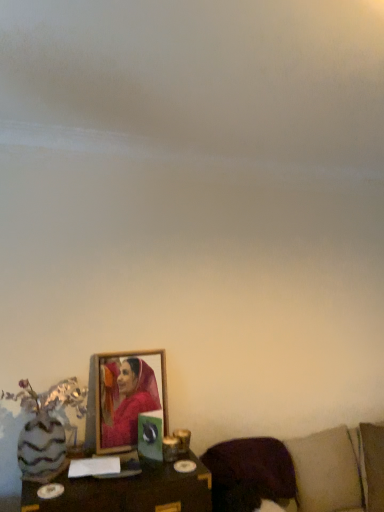
Question: Considering the positions of purple fabric pillow at lower right and wooden table at lower center in the image, is purple fabric pillow at lower right wider or thinner than wooden table at lower center?

Choices:
 (A) wide
 (B) thin

Answer: (B)

Question: From the image's perspective, is purple fabric pillow at lower right located above or below wooden table at lower center?

Choices:
 (A) below
 (B) above

Answer: (B)

Question: Which object is the closest to the wooden table at lower center?

Choices:
 (A) purple fabric pillow at lower right
 (B) brown fabric couch at lower right
 (C) wooden frame at center

Answer: (C)

Question: Estimate the real-world distances between objects in this image. Which object is farther from the purple fabric pillow at lower right?

Choices:
 (A) wooden frame at center
 (B) wooden table at lower center
 (C) brown fabric couch at lower right

Answer: (A)